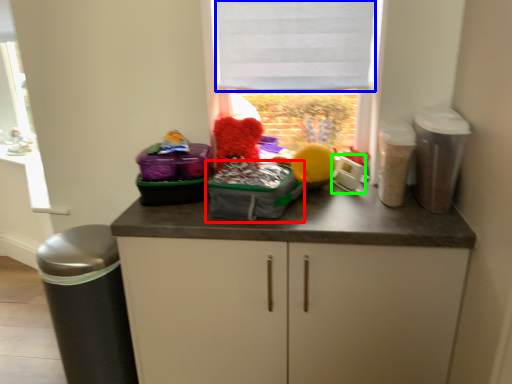
Question: Which object is positioned closest to kit (highlighted by a red box)? Select from blind (highlighted by a blue box) and appliance (highlighted by a green box).

Choices:
 (A) blind
 (B) appliance

Answer: (B)